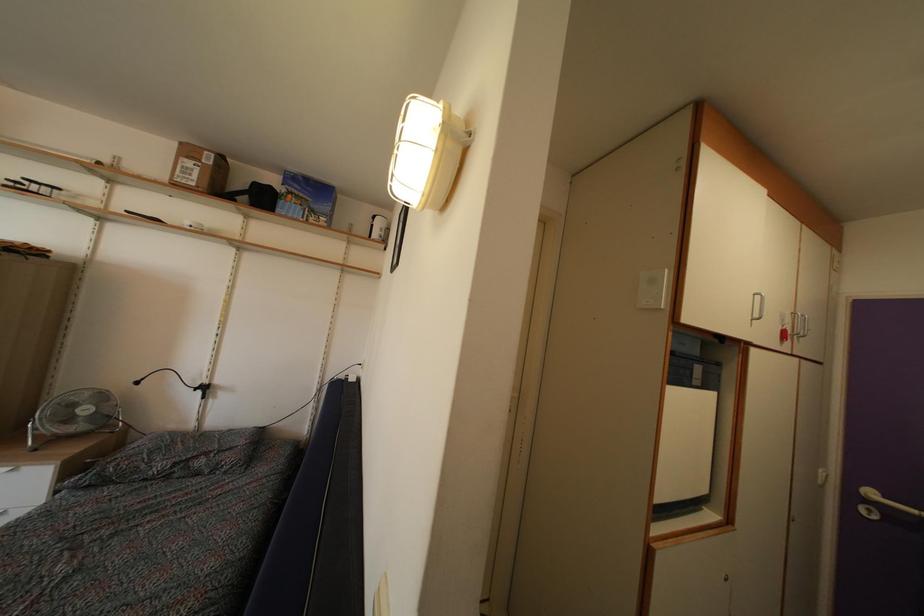
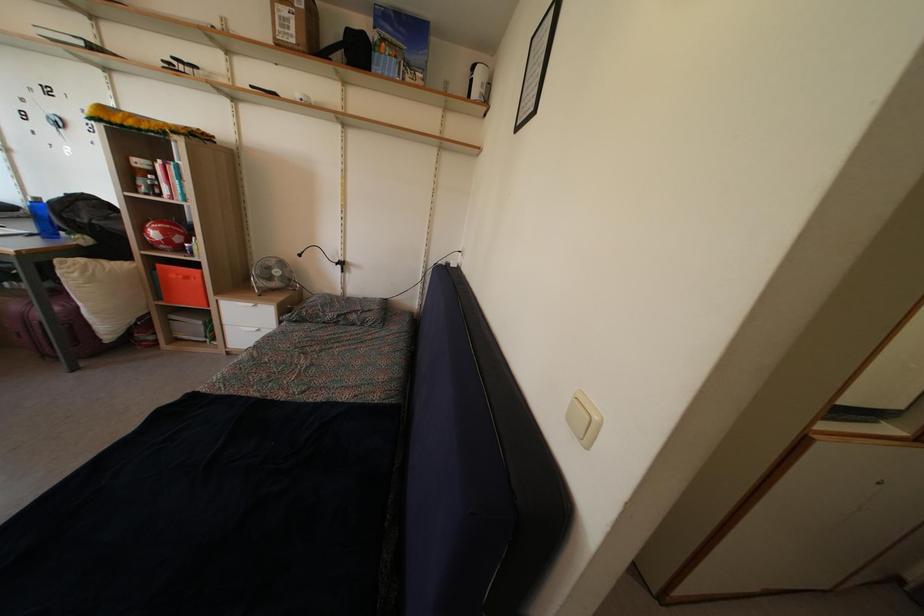
Where in the second image is the point corresponding to [196,193] from the first image?

(296, 50)